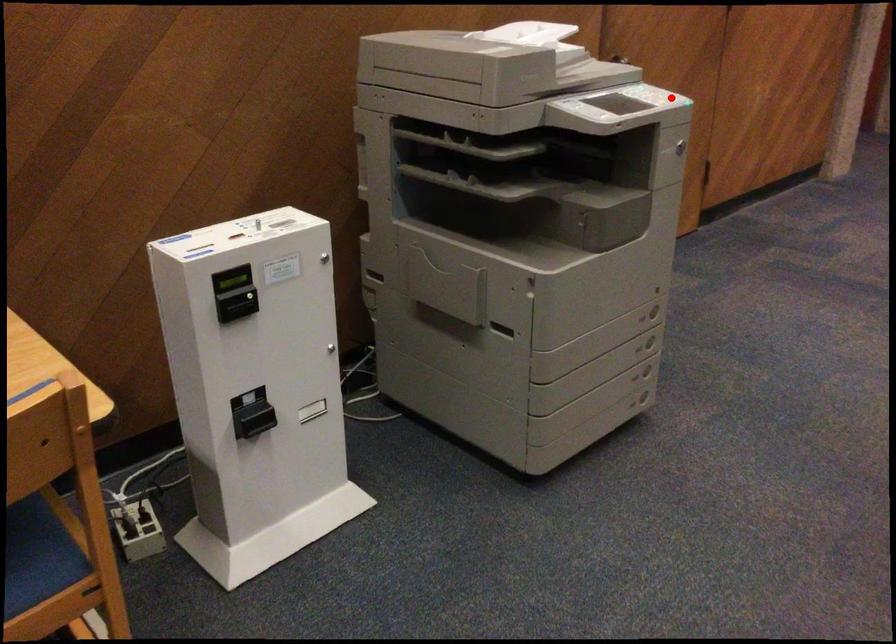
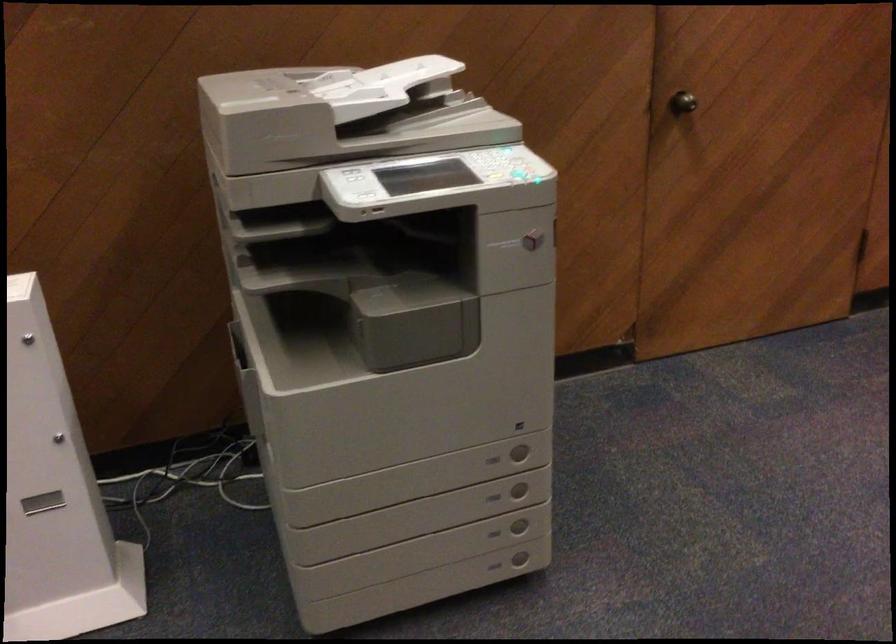
Question: I am providing you with two images of the same scene from different viewpoints. Image1 has a red point marked. In image2, the corresponding 3D location appears at what relative position? Reply with the corresponding letter.

Choices:
 (A) Closer
 (B) Farther

Answer: (A)